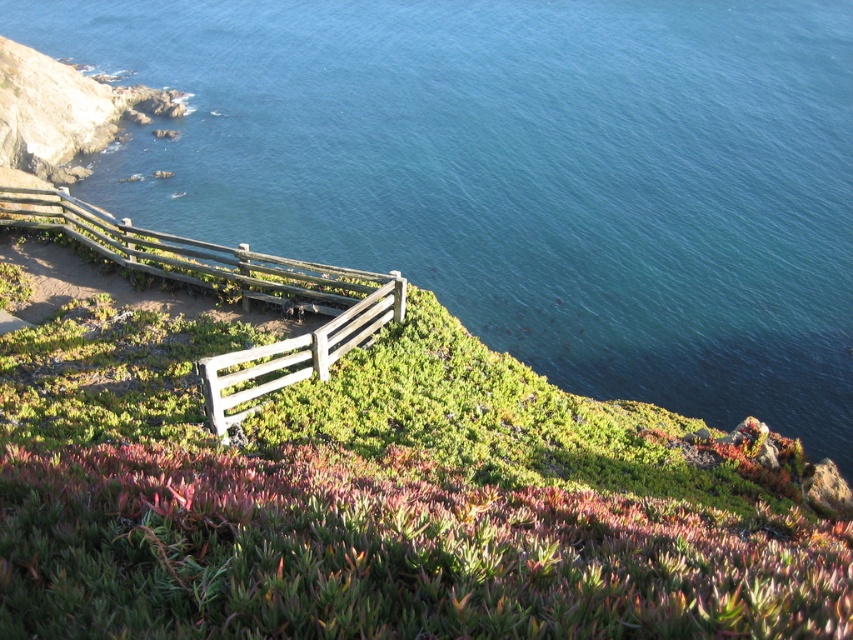
You are standing at the base of the sloping hill in the coastal landscape. You notice two points marked on the wooden fence that curves along the hill. The first point is at coordinate point (326, 634) and the second is at point (241, 285). Which point is closer to you as you stand at the base?

Point (326, 634) is closer to the camera than point (241, 285), so as you stand at the base of the hill, the first point is closer to you.

You are standing at the base of the hill and want to walk towards the blue water at upper center. Which direction should you head relative to the green succulent at lower center?

You should head to the right side of the green succulent at lower center because the blue water at upper center is positioned on the right side of it.